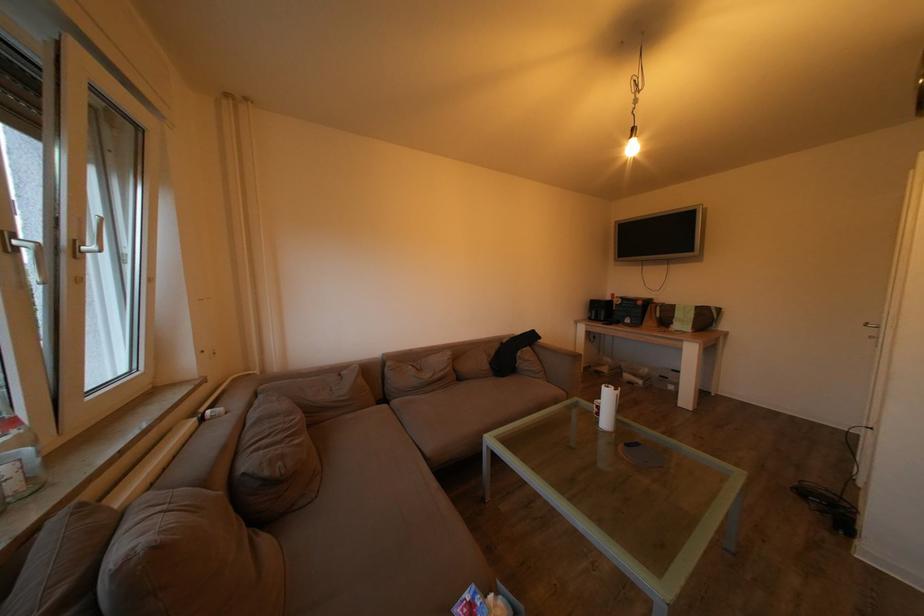
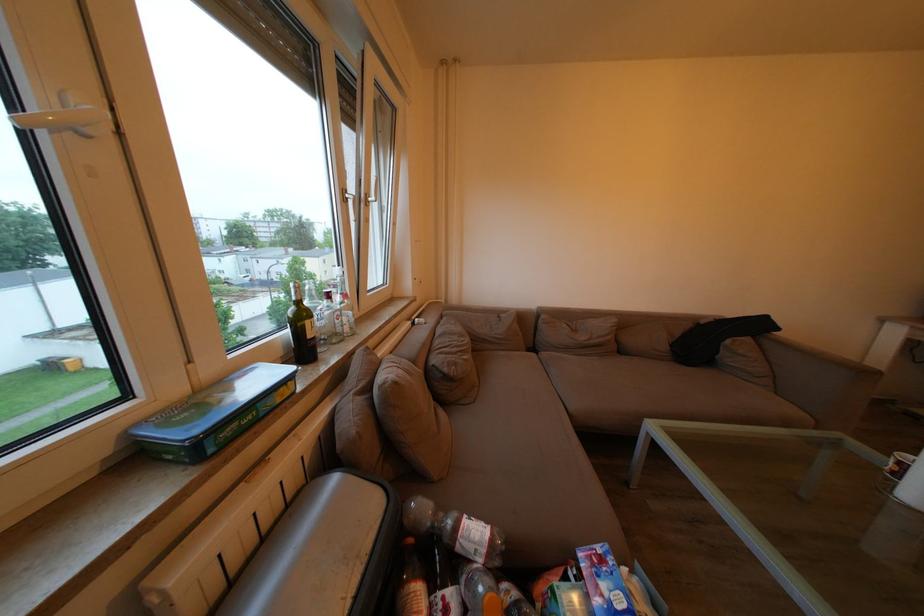
Where in the second image is the point corresponding to point (468, 385) from the first image?

(629, 358)